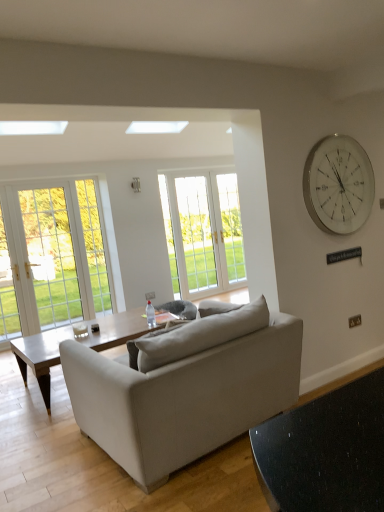
What is the approximate width of white plastic power outlet at center?

The width of white plastic power outlet at center is 1.04 inches.

What are the coordinates of `beige fabric couch at center` in the screenshot? It's located at (284, 320).

Considering the positions of points (147, 303) and (228, 253), is point (147, 303) farther from camera compared to point (228, 253)?

No, (147, 303) is in front of (228, 253).

From their relative heights in the image, would you say clear glass bottle at center is taller or shorter than white glass window at center?

Clearly, clear glass bottle at center is shorter compared to white glass window at center.

Considering the relative sizes of clear glass bottle at center and white glass window at center in the image provided, is clear glass bottle at center bigger than white glass window at center?

No, clear glass bottle at center is not bigger than white glass window at center.

Where is `power outlet behind the clear glass bottle at center`? The height and width of the screenshot is (512, 384). power outlet behind the clear glass bottle at center is located at coordinates (150, 295).

Is white plastic power outlet at center to the right of clear glass bottle at center from the viewer's perspective?

Incorrect, white plastic power outlet at center is not on the right side of clear glass bottle at center.

Based on the photo, what's the angular difference between white plastic power outlet at center and clear glass bottle at center's facing directions?

The facing directions of white plastic power outlet at center and clear glass bottle at center are 3.37 degrees apart.

Does white plastic power outlet at center have a larger size compared to clear glass bottle at center?

Incorrect, white plastic power outlet at center is not larger than clear glass bottle at center.

Considering the points (93, 396) and (240, 260), which point is behind, point (93, 396) or point (240, 260)?

The point (240, 260) is farther from the camera.

Is beige fabric couch at center to the left of white glass window at center from the viewer's perspective?

Correct, you'll find beige fabric couch at center to the left of white glass window at center.

Is white glass window at center located within beige fabric couch at center?

No, beige fabric couch at center does not contain white glass window at center.

Which is behind, beige fabric couch at center or white glass window at center?

white glass window at center is further from the camera.

Is white glass window at center aimed at white glass clock at upper right?

Yes, white glass window at center faces towards white glass clock at upper right.

From the image's perspective, which one is positioned higher, white glass window at center or white glass clock at upper right?

white glass clock at upper right, from the image's perspective.

Between white glass window at center and white glass clock at upper right, which one is positioned behind?

white glass window at center.

Which of these two, white glass window at center or white glass clock at upper right, is thinner?

Thinner between the two is white glass clock at upper right.

Can you confirm if light brown wooden coffee table at center is shorter than white plastic power outlet at center?

No.

In terms of width, does light brown wooden coffee table at center look wider or thinner when compared to white plastic power outlet at center?

Considering their sizes, light brown wooden coffee table at center looks broader than white plastic power outlet at center.

Is light brown wooden coffee table at center far away from white plastic power outlet at center?

Yes.

Does light brown wooden coffee table at center appear on the right side of white plastic power outlet at center?

In fact, light brown wooden coffee table at center is to the left of white plastic power outlet at center.

Which of these two, light brown wooden coffee table at center or white glass clock at upper right, is bigger?

light brown wooden coffee table at center is bigger.

Can you confirm if light brown wooden coffee table at center is taller than white glass clock at upper right?

Incorrect, the height of light brown wooden coffee table at center is not larger of that of white glass clock at upper right.

Is light brown wooden coffee table at center inside or outside of white glass clock at upper right?

light brown wooden coffee table at center lies outside white glass clock at upper right.

Is light brown wooden coffee table at center directly adjacent to white glass clock at upper right?

No, light brown wooden coffee table at center is not next to white glass clock at upper right.

Which point is more forward, (35, 347) or (147, 316)?

The point (35, 347) is closer.

From a real-world perspective, is light brown wooden coffee table at center on clear glass bottle at center?

Actually, light brown wooden coffee table at center is physically below clear glass bottle at center in the real world.

Can you confirm if light brown wooden coffee table at center is positioned to the left of clear glass bottle at center?

Yes.

Is light brown wooden coffee table at center not near clear glass bottle at center?

That's not correct — light brown wooden coffee table at center is a little close to clear glass bottle at center.

The width and height of the screenshot is (384, 512). Identify the location of window located above the clear glass bottle at center (from a real-world perspective). (203, 233).

The image size is (384, 512). Find the location of `power outlet below the clear glass bottle at center (from the image's perspective)`. power outlet below the clear glass bottle at center (from the image's perspective) is located at coordinates (150, 295).

From the image, which object appears to be nearer to beige fabric couch at center, white glass clock at upper right or white plastic power outlet at center?

white glass clock at upper right is closer to beige fabric couch at center.

When comparing their distances from white glass clock at upper right, does beige fabric couch at center or light brown wooden coffee table at center seem closer?

light brown wooden coffee table at center lies closer to white glass clock at upper right than the other object.

When comparing their distances from clear glass bottle at center, does white glass clock at upper right or beige fabric couch at center seem closer?

beige fabric couch at center.

Looking at the image, which one is located closer to clear glass bottle at center, white plastic power outlet at center or light brown wooden coffee table at center?

light brown wooden coffee table at center lies closer to clear glass bottle at center than the other object.

From the picture: From the image, which object appears to be farther from light brown wooden coffee table at center, white plastic power outlet at center or white glass window at center?

white glass window at center lies further to light brown wooden coffee table at center than the other object.

Estimate the real-world distances between objects in this image. Which object is further from light brown wooden coffee table at center, clear glass bottle at center or white glass clock at upper right?

white glass clock at upper right is positioned further to the anchor light brown wooden coffee table at center.

Which object lies nearer to the anchor point clear glass bottle at center, white plastic power outlet at center or beige fabric couch at center?

white plastic power outlet at center.

Looking at this image, considering their positions, is white glass window at center positioned further to white plastic power outlet at center than beige fabric couch at center?

beige fabric couch at center is further to white plastic power outlet at center.

This screenshot has height=512, width=384. Find the location of `coffee table between beige fabric couch at center and clear glass bottle at center along the z-axis`. coffee table between beige fabric couch at center and clear glass bottle at center along the z-axis is located at coordinates (40, 357).

Find the location of a particular element. This screenshot has height=512, width=384. bottle between beige fabric couch at center and white plastic power outlet at center from front to back is located at coordinates (150, 314).

I want to click on coffee table positioned between beige fabric couch at center and white glass window at center from near to far, so click(x=40, y=357).

Identify the location of bottle between light brown wooden coffee table at center and white glass window at center in the front-back direction. (150, 314).